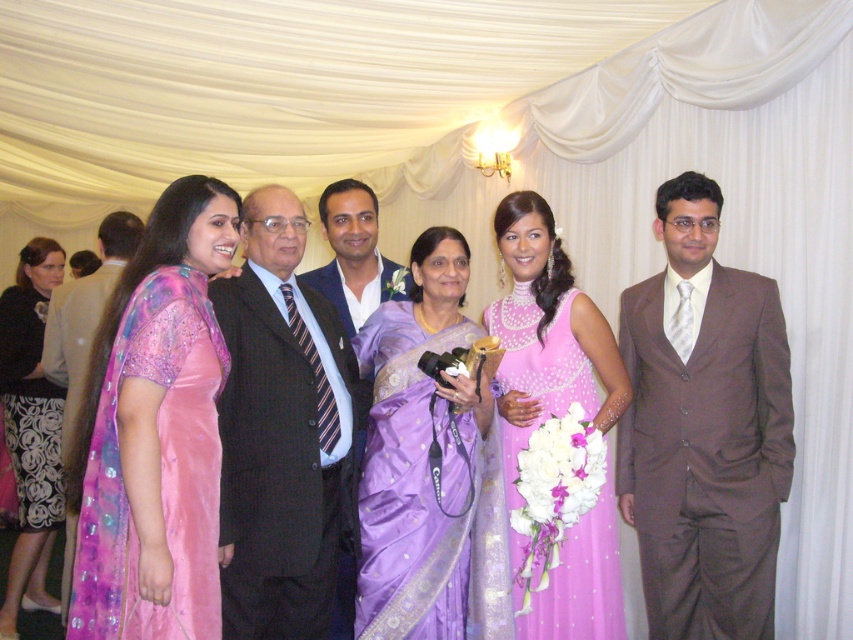
You are a photographer at this event and need to adjust the lighting so that both the pink satin saree at left and the pink satin dress at center are equally visible. Which object should you move closer to the camera to achieve this?

The pink satin dress at center should be moved closer to the camera since the pink satin saree at left is already closer to the viewer. Moving the dress forward would balance their positions, ensuring both receive adequate lighting.

Based on the coordinates provided, which object is located at point (428, 467) in the image?

The point (428, 467) corresponds to the purple satin saree at center.

You are organizing a fashion show and need to decide the order of the models based on their attire sizes. If the pink satin saree at left and the pink satin dress at center are the next two outfits to be displayed, which one should come first to maintain a size descending order?

The pink satin saree at left should come first in the descending order since it has a larger size compared to the pink satin dress at center.